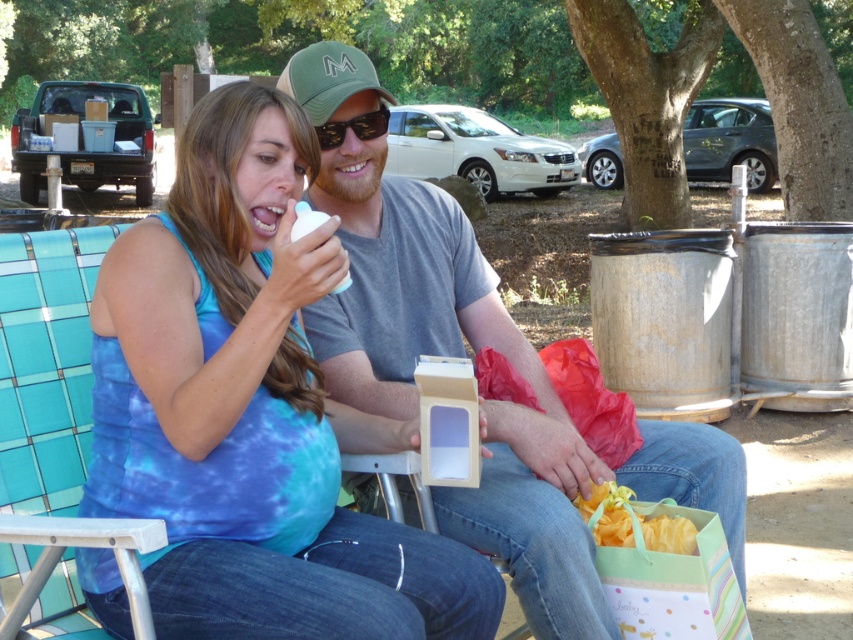
You are trying to decide whether to place a new accessory on the matte gray shirt at center or the yellow silky ribbon at lower center. Based on their sizes, which one can accommodate a larger accessory?

The matte gray shirt at center might be wider than yellow silky ribbon at lower center, so it can accommodate a larger accessory.